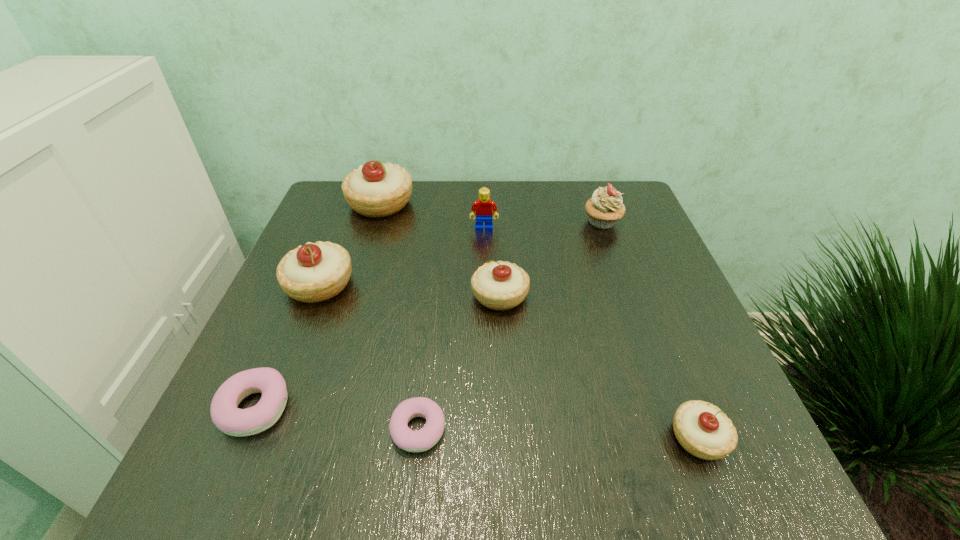
In the image, there is a desktop. At what (x,y) coordinates should I click in order to perform the action: click on vacant space at the far edge. Please return your answer as a coordinate pair (x, y). This screenshot has height=540, width=960. Looking at the image, I should click on (459, 185).

Where is `vacant point at the left edge`? The image size is (960, 540). vacant point at the left edge is located at coordinates (372, 234).

Identify the location of free space at the right edge of the desktop. pyautogui.click(x=660, y=323).

At what (x,y) coordinates should I click in order to perform the action: click on vacant space at the far left corner of the desktop. Please return your answer as a coordinate pair (x, y). This screenshot has height=540, width=960. Looking at the image, I should click on (340, 207).

The image size is (960, 540). In the image, there is a desktop. Find the location of `vacant space at the far right corner`. vacant space at the far right corner is located at coordinates (604, 185).

The image size is (960, 540). I want to click on vacant space that's between the fourth shortest pastry and the right pink pastry, so click(x=459, y=362).

Locate an element on the screen. vacant space that's between the fourth object from left to right and the red Lego is located at coordinates (451, 329).

At what (x,y) coordinates should I click in order to perform the action: click on unoccupied position between the rightmost pastry and the fifth tallest pastry. Please return your answer as a coordinate pair (x, y). Looking at the image, I should click on (477, 423).

Locate an element on the screen. The image size is (960, 540). vacant point located between the second biggest beige pastry and the cupcake is located at coordinates (461, 253).

The image size is (960, 540). What are the coordinates of `free space between the third smallest beige pastry and the Lego` in the screenshot? It's located at (402, 256).